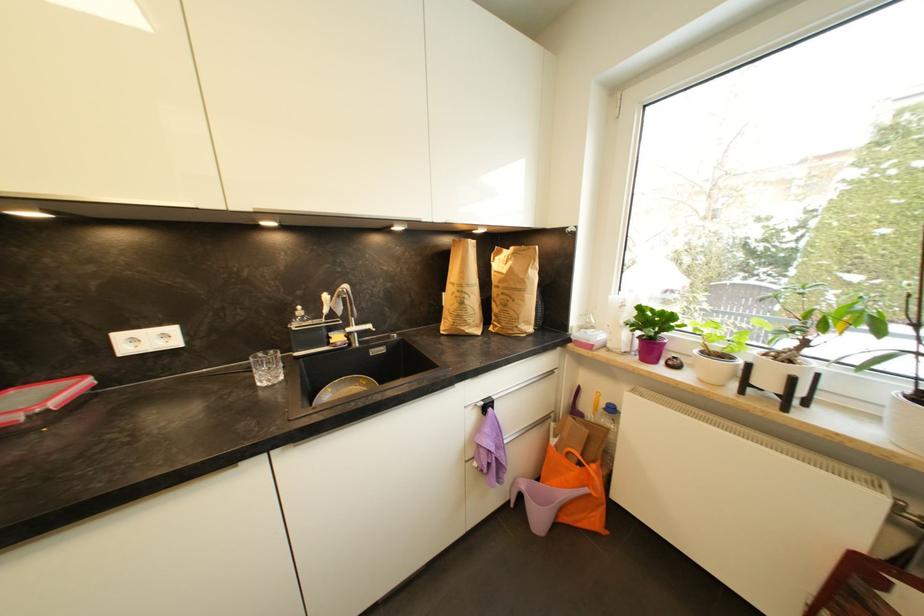
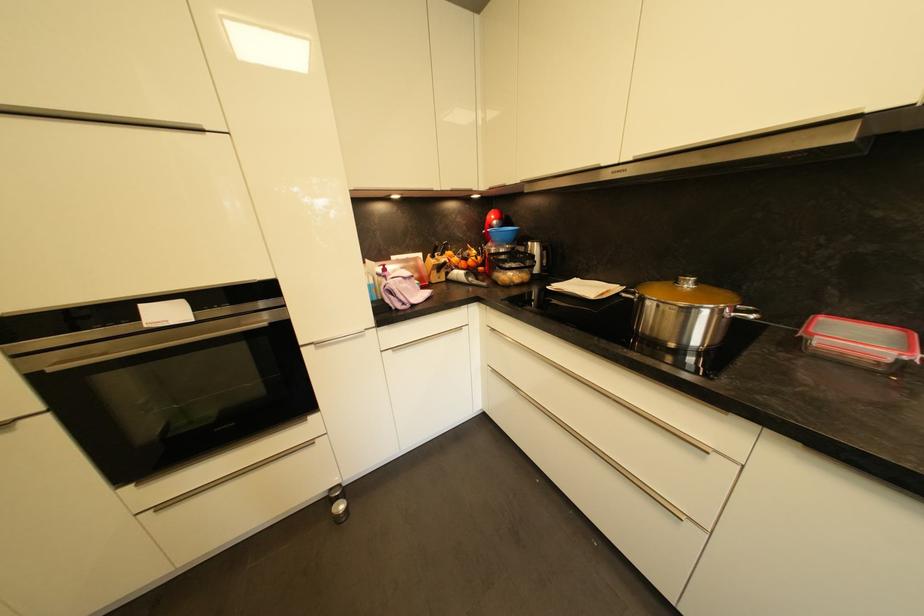
The images are taken continuously from a first-person perspective. In which direction is your viewpoint rotating?

The rotation direction of the camera is left-down.